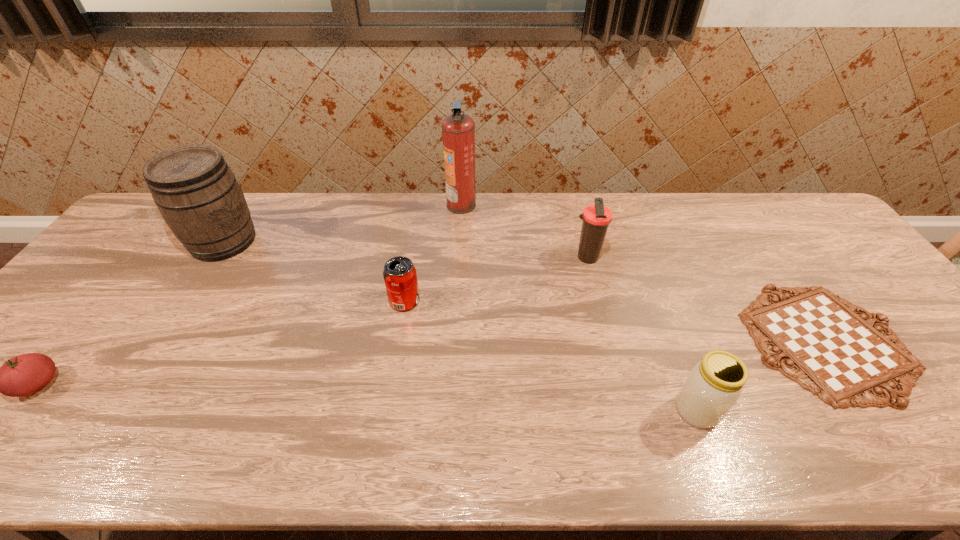
Identify the location of free space between the shortest object and the fifth object from right to left. Image resolution: width=960 pixels, height=540 pixels. tap(615, 321).

Locate an element on the screen. The height and width of the screenshot is (540, 960). empty space that is in between the fifth tallest object and the fire extinguisher is located at coordinates (433, 253).

I want to click on vacant space in between the fifth object from left to right and the chessboard, so click(707, 299).

I want to click on vacant region between the tallest object and the rightmost object, so click(644, 273).

Locate an element on the screen. the third closest object relative to the second tallest object is located at coordinates (458, 129).

Locate which object is the sixth closest to the chessboard. Please provide its 2D coordinates. Your answer should be formatted as a tuple, i.e. [(x, y)], where the tuple contains the x and y coordinates of a point satisfying the conditions above.

[(22, 375)]

Locate an element on the screen. The height and width of the screenshot is (540, 960). vacant region that satisfies the following two spatial constraints: 1. at the nozzle of the fourth object from left to right; 2. on the front side of the sixth shortest object is located at coordinates (460, 241).

Identify the location of blank area in the image that satisfies the following two spatial constraints: 1. on the back side of the thermos bottle; 2. on the left side of the fifth object from right to left. The width and height of the screenshot is (960, 540). (412, 258).